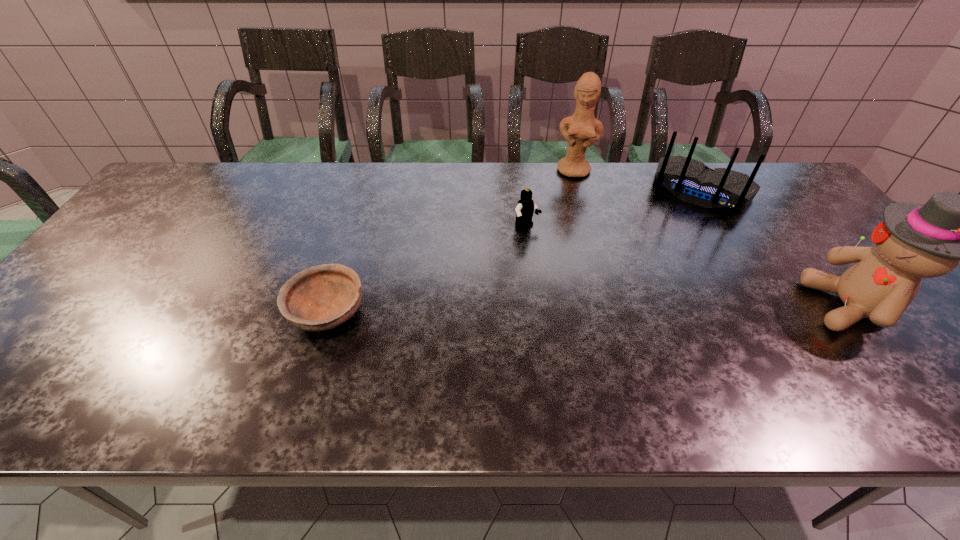
Identify the location of figurine present at the far edge. The width and height of the screenshot is (960, 540). (585, 130).

Locate an element on the screen. The width and height of the screenshot is (960, 540). router that is at the far edge is located at coordinates (690, 180).

The width and height of the screenshot is (960, 540). I want to click on bowl that is at the near edge, so click(x=322, y=297).

This screenshot has width=960, height=540. Identify the location of rag_doll that is at the near edge. (914, 241).

Where is `rag_doll at the right edge`? This screenshot has height=540, width=960. rag_doll at the right edge is located at coordinates (914, 241).

Find the location of a particular element. This screenshot has width=960, height=540. router positioned at the right edge is located at coordinates (690, 180).

At what (x,y) coordinates should I click in order to perform the action: click on object present at the far right corner. Please return your answer as a coordinate pair (x, y). The height and width of the screenshot is (540, 960). Looking at the image, I should click on (690, 180).

Where is `object located in the near right corner section of the desktop`? The width and height of the screenshot is (960, 540). object located in the near right corner section of the desktop is located at coordinates (914, 241).

Where is `vacant area at the far edge of the desktop`? Image resolution: width=960 pixels, height=540 pixels. vacant area at the far edge of the desktop is located at coordinates (655, 197).

Find the location of `vacant space at the near edge of the desktop`. vacant space at the near edge of the desktop is located at coordinates (338, 355).